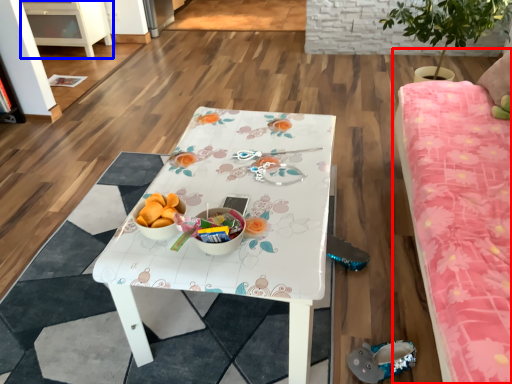
Question: Which object is further to the camera taking this photo, studio couch (highlighted by a red box) or cabinetry (highlighted by a blue box)?

Choices:
 (A) studio couch
 (B) cabinetry

Answer: (B)